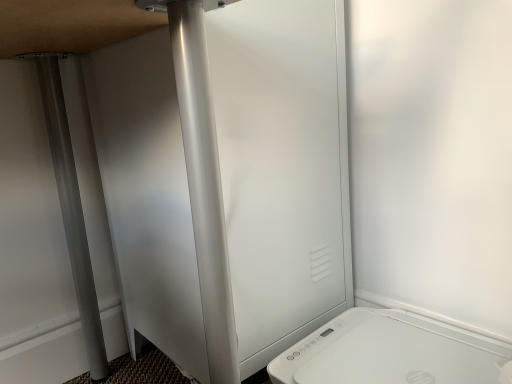
The width and height of the screenshot is (512, 384). I want to click on satin silver screen door at center, so click(x=282, y=167).

This screenshot has height=384, width=512. What do you see at coordinates (282, 167) in the screenshot? I see `satin silver screen door at center` at bounding box center [282, 167].

You are a GUI agent. You are given a task and a screenshot of the screen. Output one action in this format:
    pyautogui.click(x=<x>, y=<y>)
    Task: Click on the white plastic toaster at lower right
    
    Given the screenshot: What is the action you would take?
    pyautogui.click(x=391, y=352)

The width and height of the screenshot is (512, 384). Describe the element at coordinates (391, 352) in the screenshot. I see `white plastic toaster at lower right` at that location.

I want to click on satin silver screen door at center, so click(282, 167).

Is satin silver screen door at center to the left or to the right of white plastic toaster at lower right in the image?

Based on their positions, satin silver screen door at center is located to the left of white plastic toaster at lower right.

Which object is closer to the camera taking this photo, satin silver screen door at center or white plastic toaster at lower right?

white plastic toaster at lower right is closer to the camera.

Which is less distant, (298, 302) or (492, 340)?

The point (492, 340) is closer to the camera.

From the image's perspective, is satin silver screen door at center over white plastic toaster at lower right?

Correct, satin silver screen door at center appears higher than white plastic toaster at lower right in the image.

Looking at this image, from a real-world perspective, is satin silver screen door at center located higher than white plastic toaster at lower right?

Yes, from a real-world perspective, satin silver screen door at center is over white plastic toaster at lower right

Which object is thinner, satin silver screen door at center or white plastic toaster at lower right?

white plastic toaster at lower right is thinner.

Between satin silver screen door at center and white plastic toaster at lower right, which one has more height?

Standing taller between the two is satin silver screen door at center.

Does satin silver screen door at center have a smaller size compared to white plastic toaster at lower right?

Actually, satin silver screen door at center might be larger than white plastic toaster at lower right.

Is satin silver screen door at center surrounding white plastic toaster at lower right?

Actually, white plastic toaster at lower right is outside satin silver screen door at center.

Does satin silver screen door at center touch white plastic toaster at lower right?

satin silver screen door at center is not next to white plastic toaster at lower right, and they're not touching.

Is satin silver screen door at center looking in the opposite direction of white plastic toaster at lower right?

That's not correct — satin silver screen door at center is not looking away from white plastic toaster at lower right.

Can you tell me how much satin silver screen door at center and white plastic toaster at lower right differ in facing direction?

89.9 degrees separate the facing orientations of satin silver screen door at center and white plastic toaster at lower right.

At what (x,y) coordinates should I click in order to perform the action: click on screen door lying above the white plastic toaster at lower right (from the image's perspective). Please return your answer as a coordinate pair (x, y). The height and width of the screenshot is (384, 512). Looking at the image, I should click on (282, 167).

Is white plastic toaster at lower right at the right side of satin silver screen door at center?

Correct, you'll find white plastic toaster at lower right to the right of satin silver screen door at center.

Who is more distant, white plastic toaster at lower right or satin silver screen door at center?

Positioned behind is satin silver screen door at center.

Which is behind, point (391, 322) or point (167, 348)?

The point (167, 348) is more distant.

From the image's perspective, who appears lower, white plastic toaster at lower right or satin silver screen door at center?

→ white plastic toaster at lower right, from the image's perspective.

From a real-world perspective, who is located higher, white plastic toaster at lower right or satin silver screen door at center?

satin silver screen door at center, from a real-world perspective.

Between white plastic toaster at lower right and satin silver screen door at center, which one has larger width?

satin silver screen door at center is wider.

In terms of height, does white plastic toaster at lower right look taller or shorter compared to satin silver screen door at center?

white plastic toaster at lower right is shorter than satin silver screen door at center.

Looking at the image, does white plastic toaster at lower right seem bigger or smaller compared to satin silver screen door at center?

In the image, white plastic toaster at lower right appears to be smaller than satin silver screen door at center.

Is white plastic toaster at lower right completely or partially outside of satin silver screen door at center?

Absolutely, white plastic toaster at lower right is external to satin silver screen door at center.

Is white plastic toaster at lower right not near satin silver screen door at center?

No.

Could you tell me if white plastic toaster at lower right is facing satin silver screen door at center?

No, white plastic toaster at lower right is not facing towards satin silver screen door at center.

This screenshot has height=384, width=512. What are the coordinates of `home appliance located in front of the satin silver screen door at center` in the screenshot? It's located at (391, 352).

Locate an element on the screen. screen door on the left of white plastic toaster at lower right is located at coordinates (282, 167).

Identify the location of screen door above the white plastic toaster at lower right (from a real-world perspective). Image resolution: width=512 pixels, height=384 pixels. (282, 167).